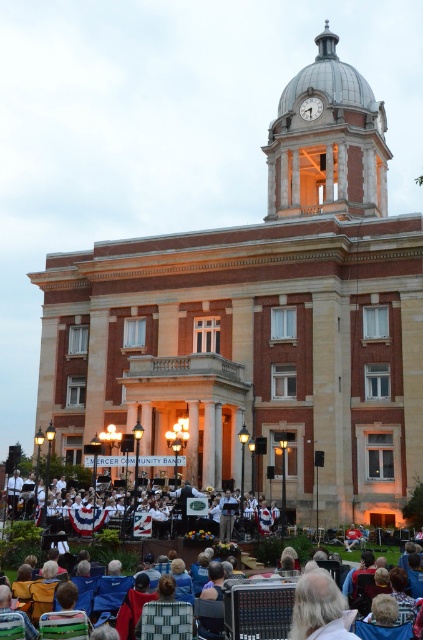
Is metallic dome clock tower at upper center in front of white uniformed band at center?

No, metallic dome clock tower at upper center is further to the viewer.

Is metallic dome clock tower at upper center bigger than white uniformed band at center?

Correct, metallic dome clock tower at upper center is larger in size than white uniformed band at center.

Does point (357, 209) lie in front of point (250, 532)?

No, it is behind (250, 532).

Locate an element on the screen. This screenshot has width=423, height=640. metallic dome clock tower at upper center is located at coordinates (327, 141).

Based on the photo, does white uniformed band at center have a larger size compared to metallic clock face at center?

Correct, white uniformed band at center is larger in size than metallic clock face at center.

Measure the distance between white uniformed band at center and camera.

white uniformed band at center and camera are 48.41 meters apart.

This screenshot has height=640, width=423. What are the coordinates of `white uniformed band at center` in the screenshot? It's located at (257, 522).

Between metallic dome clock tower at upper center and metallic clock face at center, which one has less height?

With less height is metallic clock face at center.

Between point (304, 202) and point (316, 102), which one is positioned behind?

The point (304, 202) is behind.

Who is more distant from viewer, (310, 208) or (313, 116)?

Point (313, 116)

Locate an element on the screen. The image size is (423, 640). metallic dome clock tower at upper center is located at coordinates (327, 141).